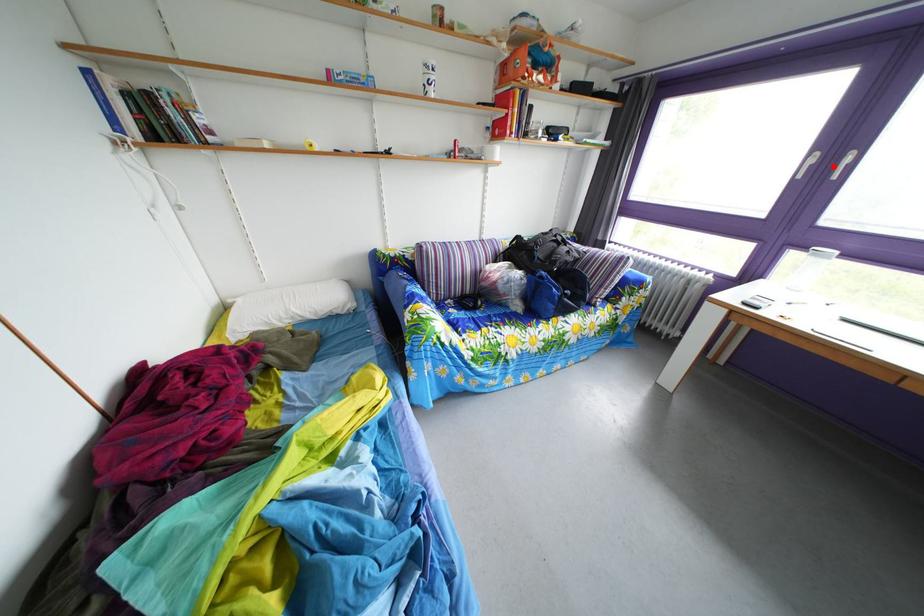
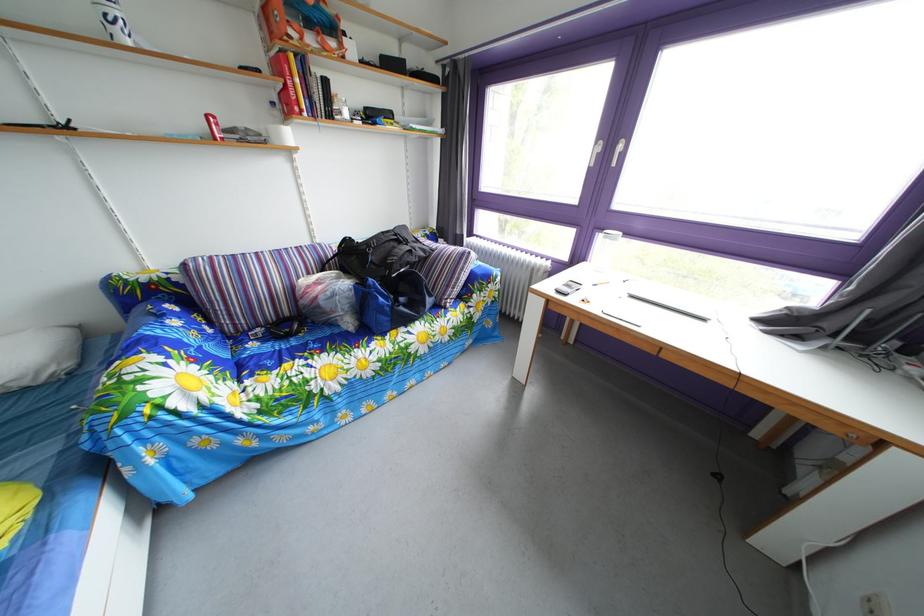
The point at the highlighted location is marked in the first image. Where is the corresponding point in the second image?

(616, 156)